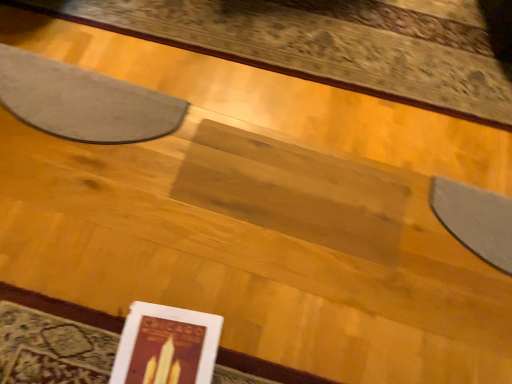
Question: From the image's perspective, is gray felt mat at upper left located above or below matte paper book at lower left?

Choices:
 (A) below
 (B) above

Answer: (B)

Question: Is gray felt mat at upper left inside or outside of matte paper book at lower left?

Choices:
 (A) outside
 (B) inside

Answer: (A)

Question: Looking at their shapes, would you say gray felt mat at upper left is wider or thinner than matte paper book at lower left?

Choices:
 (A) thin
 (B) wide

Answer: (A)

Question: Is point (187, 337) positioned closer to the camera than point (161, 109)?

Choices:
 (A) closer
 (B) farther

Answer: (A)

Question: In the image, is matte paper book at lower left on the left side or the right side of gray felt mat at upper left?

Choices:
 (A) left
 (B) right

Answer: (B)

Question: Considering their positions, is matte paper book at lower left located in front of or behind gray felt mat at upper left?

Choices:
 (A) front
 (B) behind

Answer: (A)

Question: Looking at the image, does matte paper book at lower left seem bigger or smaller compared to gray felt mat at upper left?

Choices:
 (A) big
 (B) small

Answer: (B)